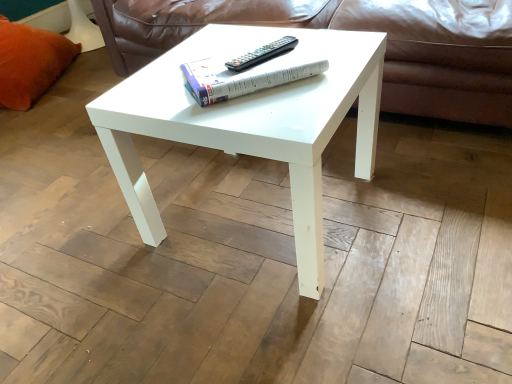
Locate an element on the screen. free spot above white glossy coffee table at center (from a real-world perspective) is located at coordinates (243, 69).